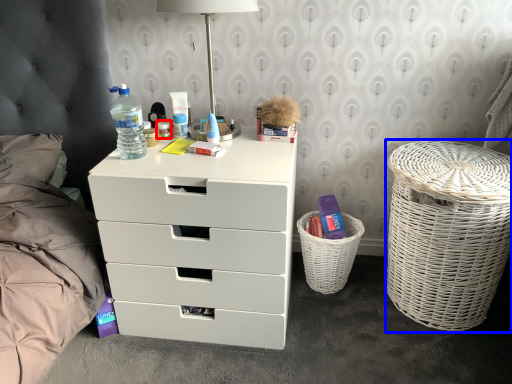
Question: Which object appears farthest to the camera in this image, toiletry (highlighted by a red box) or laundry basket (highlighted by a blue box)?

Choices:
 (A) toiletry
 (B) laundry basket

Answer: (A)